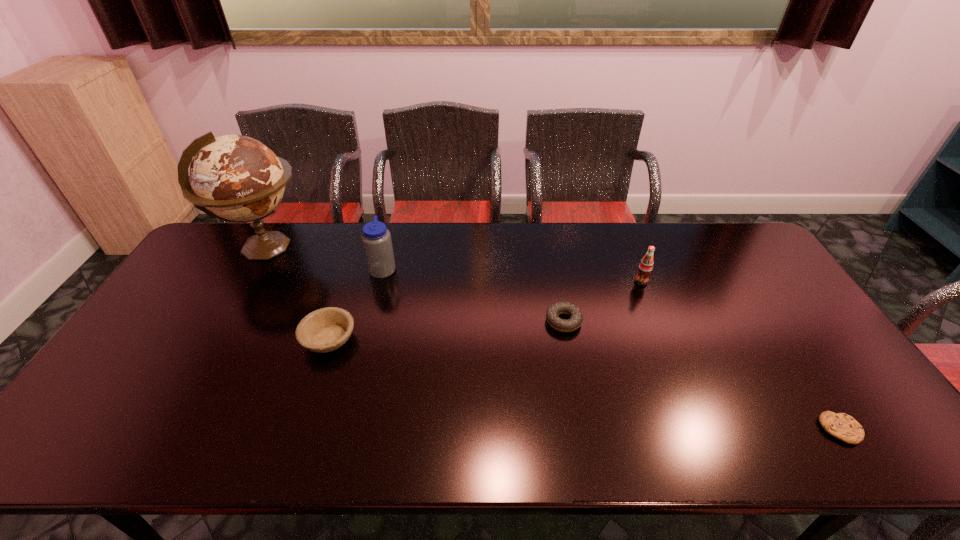
The image size is (960, 540). In order to click on vacant area situated 0.200m on the front of the globe showing Asia in this screenshot , I will do `click(369, 248)`.

At what (x,y) coordinates should I click in order to perform the action: click on blank space located 0.350m with a carrying loop on the side of the water bottle. Please return your answer as a coordinate pair (x, y). Looking at the image, I should click on (503, 268).

At what (x,y) coordinates should I click in order to perform the action: click on vacant position located on the right of the soda. Please return your answer as a coordinate pair (x, y). Looking at the image, I should click on click(710, 281).

Locate an element on the screen. This screenshot has width=960, height=540. vacant space positioned 0.380m on the back of the bowl is located at coordinates (362, 240).

The width and height of the screenshot is (960, 540). In order to click on vacant region located 0.260m on the left of the fourth object from left to right in this screenshot , I will do point(456,321).

Where is `vacant space located on the back of the cookie`? The width and height of the screenshot is (960, 540). vacant space located on the back of the cookie is located at coordinates (790, 353).

In order to click on globe located at the far edge in this screenshot , I will do `click(235, 178)`.

Identify the location of water bottle that is at the far edge. (376, 239).

Identify the location of object that is at the near edge. (842, 426).

The width and height of the screenshot is (960, 540). Identify the location of object present at the left edge. click(235, 178).